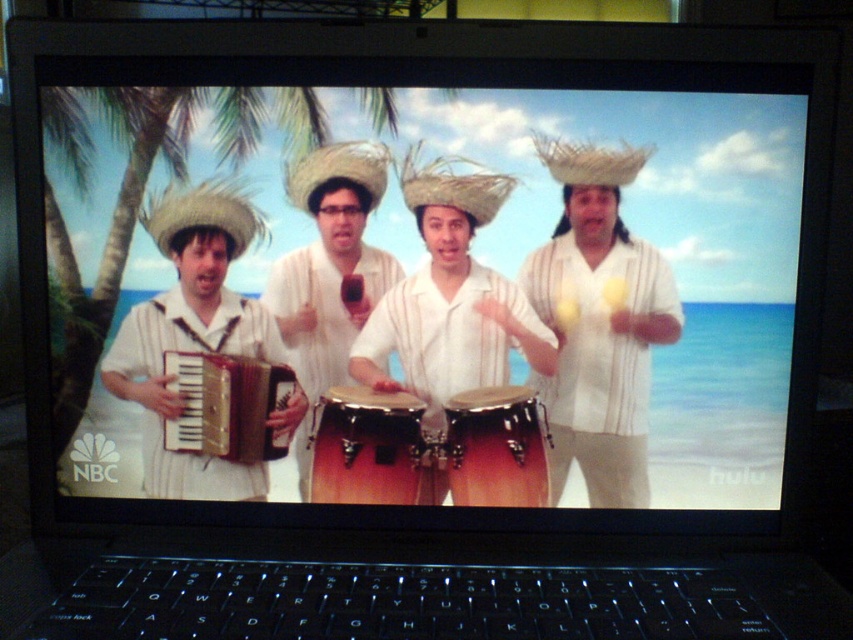
Question: Considering the real-world distances, which object is closest to the gold metallic accordion at left?

Choices:
 (A) white striped shirt at center
 (B) matte white shirt at center
 (C) matte white shirt at left

Answer: (C)

Question: Is matte white shirt at center above gold metallic accordion at left?

Choices:
 (A) no
 (B) yes

Answer: (B)

Question: Estimate the real-world distances between objects in this image. Which object is closer to the white striped shirt at center?

Choices:
 (A) brown wooden drum at center
 (B) matte white shirt at center
 (C) gold metallic accordion at left
 (D) wooden drum at center

Answer: (A)

Question: Can you confirm if white striped shirt at center is bigger than gold metallic accordion at left?

Choices:
 (A) yes
 (B) no

Answer: (A)

Question: Does matte white shirt at center come behind wooden drum at center?

Choices:
 (A) no
 (B) yes

Answer: (A)

Question: Which object is positioned farthest from the wooden drum at center?

Choices:
 (A) gold metallic accordion at left
 (B) brown wooden drum at center
 (C) matte white shirt at left

Answer: (C)